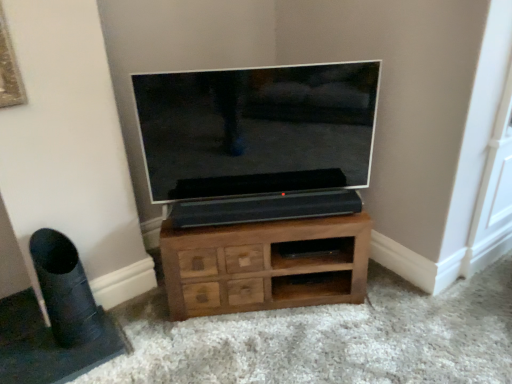
Question: In terms of width, does brown wood chest of drawers at center look wider or thinner when compared to flat screen tv at center?

Choices:
 (A) thin
 (B) wide

Answer: (B)

Question: Is brown wood chest of drawers at center in front of or behind flat screen tv at center in the image?

Choices:
 (A) front
 (B) behind

Answer: (B)

Question: Considering the real-world distances, which object is closest to the brown wood chest of drawers at center?

Choices:
 (A) black matte speaker at lower left
 (B) flat screen tv at center

Answer: (B)

Question: Estimate the real-world distances between objects in this image. Which object is farther from the brown wood chest of drawers at center?

Choices:
 (A) black matte speaker at lower left
 (B) flat screen tv at center

Answer: (A)